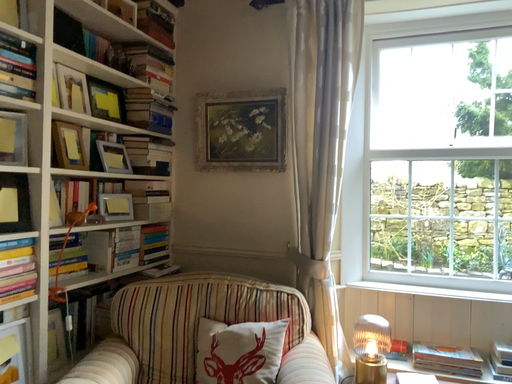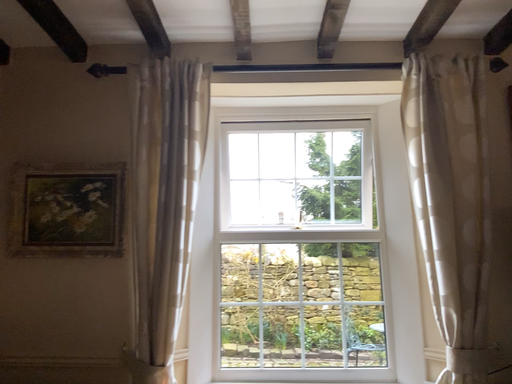
Question: How did the camera likely rotate when shooting the video?

Choices:
 (A) rotated downward
 (B) rotated upward

Answer: (B)